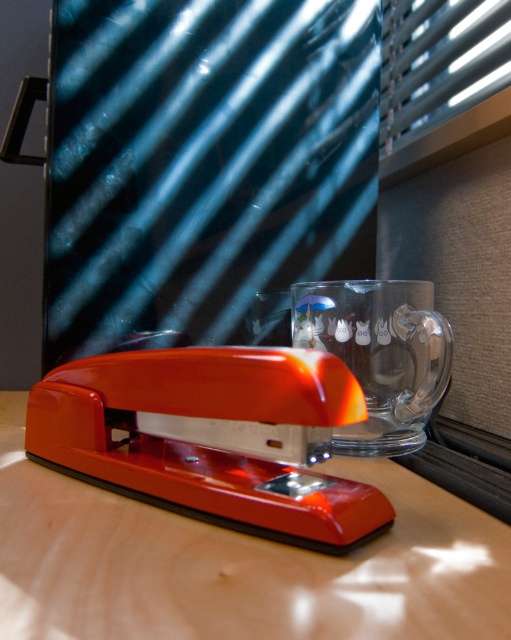
You are organizing items on a desk and need to place a new object between the glossy wood stapler at lower left and the transparent glass at center. Can you fit it there?

The glossy wood stapler at lower left is closer to the viewer than the transparent glass at center, so there is space between them for the new object.

You are organizing items on a desk and need to place a small note between the glossy plastic stapler at center and the transparent glass at center. Can you slide it in between them without moving either object?

The glossy plastic stapler at center is closer to the viewer than the transparent glass at center, so there is space between them for the note to slide in.

You are organizing items on a desk and need to know which object is shorter between the transparent glass at center and the metallic blinds at upper right. Can you determine this?

The transparent glass at center has a lesser height compared to the metallic blinds at upper right, so the transparent glass at center is shorter.